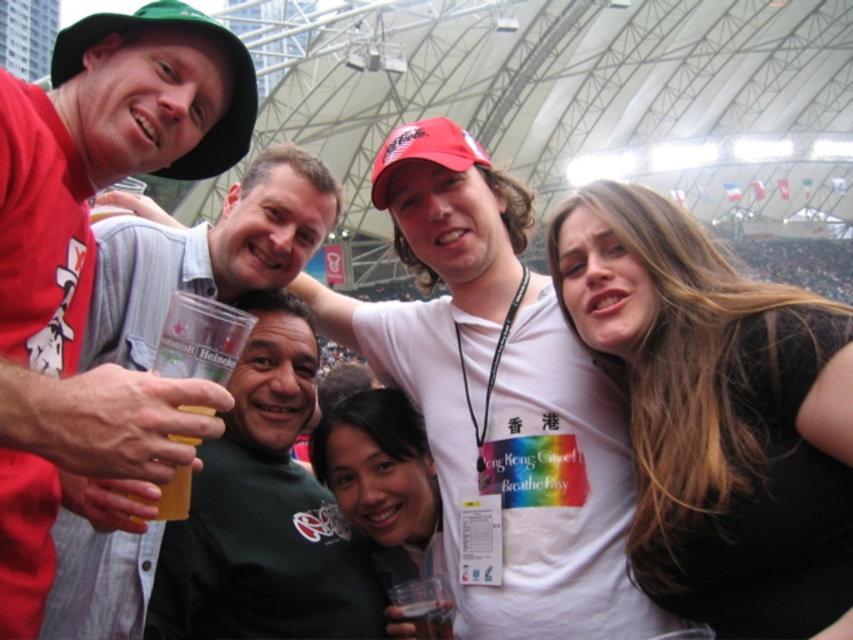
Question: Based on their relative distances, which object is nearer to the matte black hat at upper left?

Choices:
 (A) black matte hair at upper right
 (B) green matte shirt at center

Answer: (B)

Question: Can you confirm if black matte hair at upper right is bigger than matte black hat at upper left?

Choices:
 (A) yes
 (B) no

Answer: (B)

Question: Considering the relative positions of green matte shirt at center and green fabric baseball hat at upper left in the image provided, where is green matte shirt at center located with respect to green fabric baseball hat at upper left?

Choices:
 (A) left
 (B) right

Answer: (B)

Question: Is white cotton t-shirt at center below red matte baseball cap at center?

Choices:
 (A) no
 (B) yes

Answer: (B)

Question: Which of the following is the closest to the observer?

Choices:
 (A) (90, 20)
 (B) (718, 387)

Answer: (A)

Question: Which point appears closest to the camera in this image?

Choices:
 (A) (704, 371)
 (B) (196, 176)
 (C) (422, 618)
 (D) (267, 474)

Answer: (A)